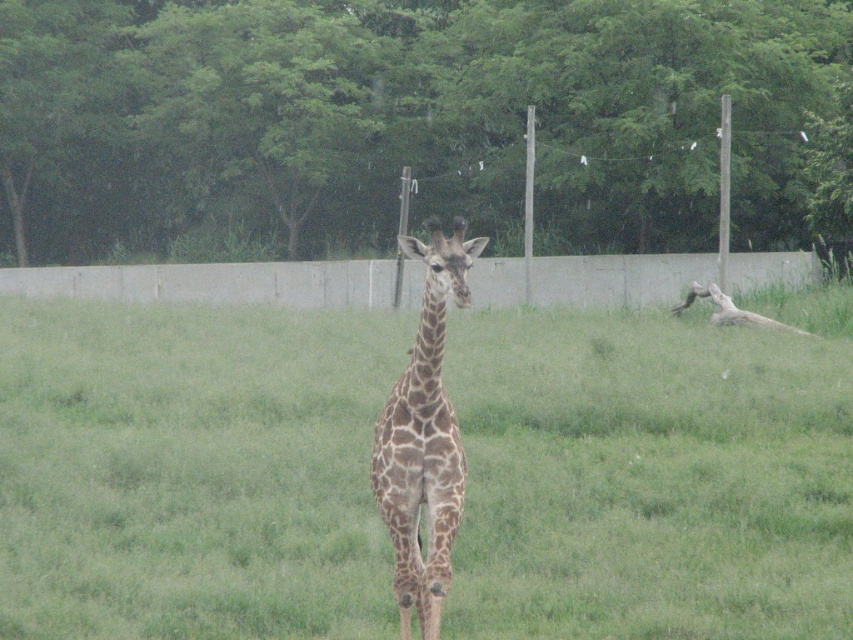
Is green leafy tree at upper center bigger than gray concrete fence at center?

Yes, green leafy tree at upper center is bigger than gray concrete fence at center.

Is point (692, 96) less distant than point (556, 300)?

That is True.

Identify the location of green leafy tree at upper center. (416, 124).

Between point (181, 24) and point (422, 404), which one is positioned behind?

The point (181, 24) is behind.

Who is more forward, [785,218] or [428,380]?

Positioned in front is point [428,380].

What are the coordinates of `green leafy tree at upper center` in the screenshot? It's located at (416, 124).

Is gray concrete fence at center to the right of brown spotted giraffe at center from the viewer's perspective?

Incorrect, gray concrete fence at center is not on the right side of brown spotted giraffe at center.

Is gray concrete fence at center smaller than brown spotted giraffe at center?

Actually, gray concrete fence at center might be larger than brown spotted giraffe at center.

Which is in front, point (755, 275) or point (422, 428)?

Point (422, 428) is more forward.

You are a GUI agent. You are given a task and a screenshot of the screen. Output one action in this format:
    pyautogui.click(x=<x>, y=<y>)
    Task: Click on the gray concrete fence at center
    This screenshot has height=640, width=853.
    Given the screenshot: What is the action you would take?
    pyautogui.click(x=213, y=282)